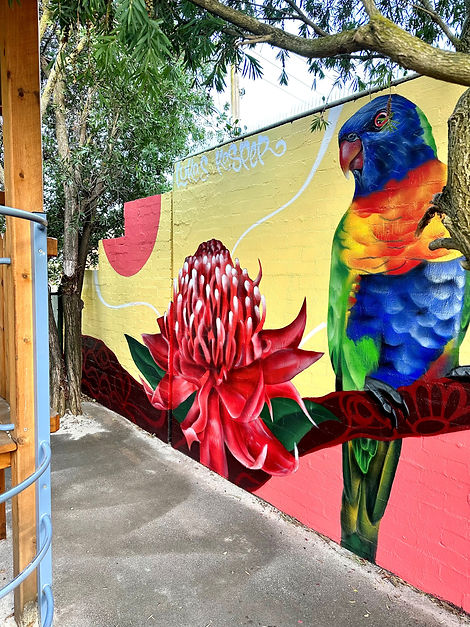
This screenshot has height=627, width=470. What are the coordinates of `mural painting of parriot` in the screenshot? It's located at (383, 246).